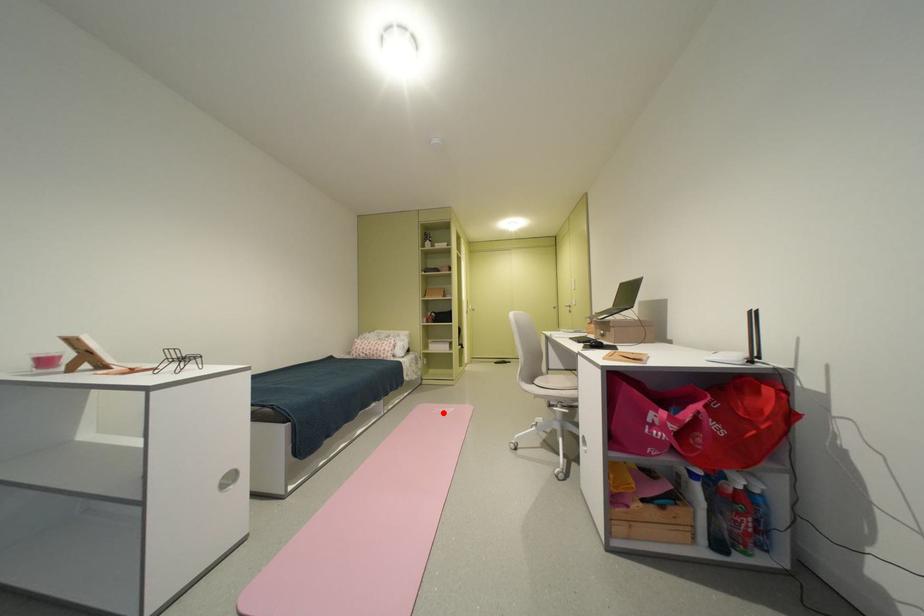
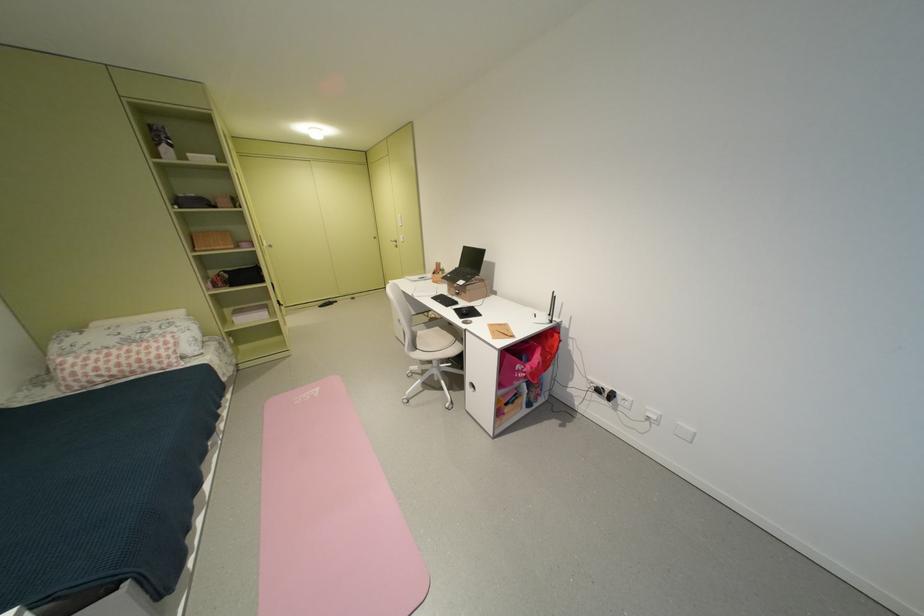
Find the pixel in the second image that matches the highlighted location in the first image.

(305, 403)